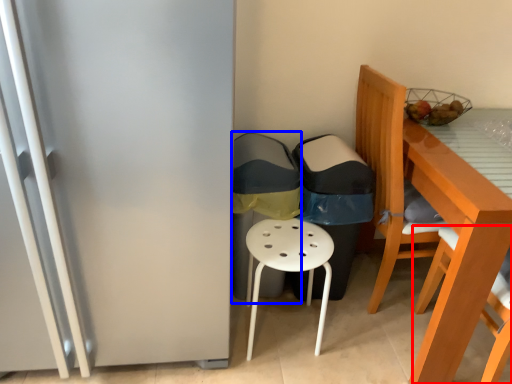
Question: Which object is closer to the camera taking this photo, chair (highlighted by a red box) or garbage (highlighted by a blue box)?

Choices:
 (A) chair
 (B) garbage

Answer: (A)